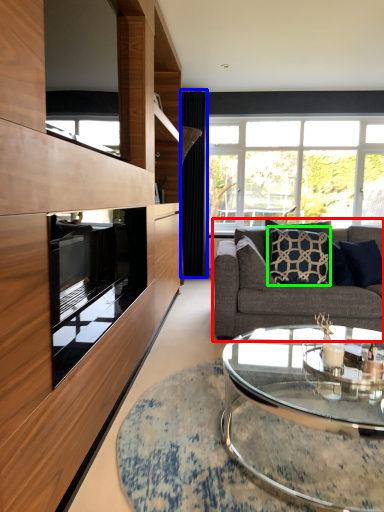
Question: Estimate the real-world distances between objects in this image. Which object is farther from studio couch (highlighted by a red box), curtain (highlighted by a blue box) or pillow (highlighted by a green box)?

Choices:
 (A) curtain
 (B) pillow

Answer: (A)